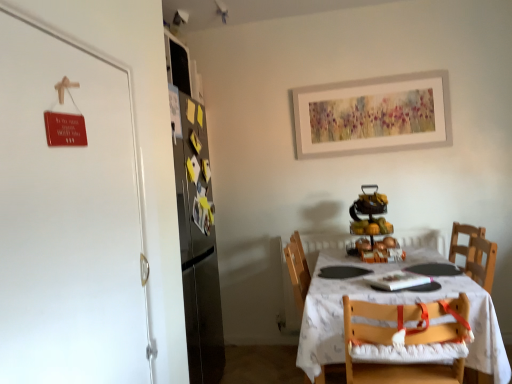
Question: Is metallic refrigerator at upper left not close to shiny metallic fruit stand at center?

Choices:
 (A) no
 (B) yes

Answer: (B)

Question: Can shiny metallic fruit stand at center be found inside metallic refrigerator at upper left?

Choices:
 (A) no
 (B) yes

Answer: (A)

Question: Is metallic refrigerator at upper left looking in the opposite direction of shiny metallic fruit stand at center?

Choices:
 (A) no
 (B) yes

Answer: (A)

Question: Considering the relative sizes of metallic refrigerator at upper left and shiny metallic fruit stand at center in the image provided, is metallic refrigerator at upper left shorter than shiny metallic fruit stand at center?

Choices:
 (A) no
 (B) yes

Answer: (A)

Question: Does metallic refrigerator at upper left turn towards shiny metallic fruit stand at center?

Choices:
 (A) yes
 (B) no

Answer: (B)

Question: Considering the positions of metallic refrigerator at upper left and shiny metallic fruit stand at center in the image, is metallic refrigerator at upper left bigger or smaller than shiny metallic fruit stand at center?

Choices:
 (A) big
 (B) small

Answer: (A)

Question: Is metallic refrigerator at upper left wider or thinner than shiny metallic fruit stand at center?

Choices:
 (A) wide
 (B) thin

Answer: (B)

Question: From a real-world perspective, is metallic refrigerator at upper left positioned above or below shiny metallic fruit stand at center?

Choices:
 (A) below
 (B) above

Answer: (B)

Question: Is metallic refrigerator at upper left situated inside shiny metallic fruit stand at center or outside?

Choices:
 (A) outside
 (B) inside

Answer: (A)

Question: Looking at their shapes, would you say metallic refrigerator at upper left is wider or thinner than white cloth-covered table at center?

Choices:
 (A) thin
 (B) wide

Answer: (A)

Question: Is metallic refrigerator at upper left bigger or smaller than white cloth-covered table at center?

Choices:
 (A) small
 (B) big

Answer: (A)

Question: In the image, is metallic refrigerator at upper left positioned in front of or behind white cloth-covered table at center?

Choices:
 (A) behind
 (B) front

Answer: (A)

Question: Is metallic refrigerator at upper left inside or outside of white cloth-covered table at center?

Choices:
 (A) inside
 (B) outside

Answer: (B)

Question: From a real-world perspective, is shiny metallic fruit stand at center above or below metallic refrigerator at upper left?

Choices:
 (A) above
 (B) below

Answer: (B)

Question: Is shiny metallic fruit stand at center taller or shorter than metallic refrigerator at upper left?

Choices:
 (A) short
 (B) tall

Answer: (A)